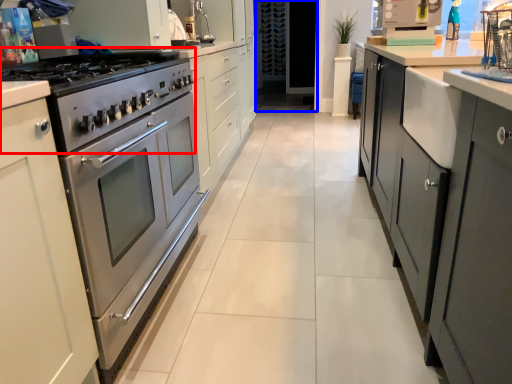
Question: Among these objects, which one is nearest to the camera, gas stove (highlighted by a red box) or glass door (highlighted by a blue box)?

Choices:
 (A) gas stove
 (B) glass door

Answer: (A)